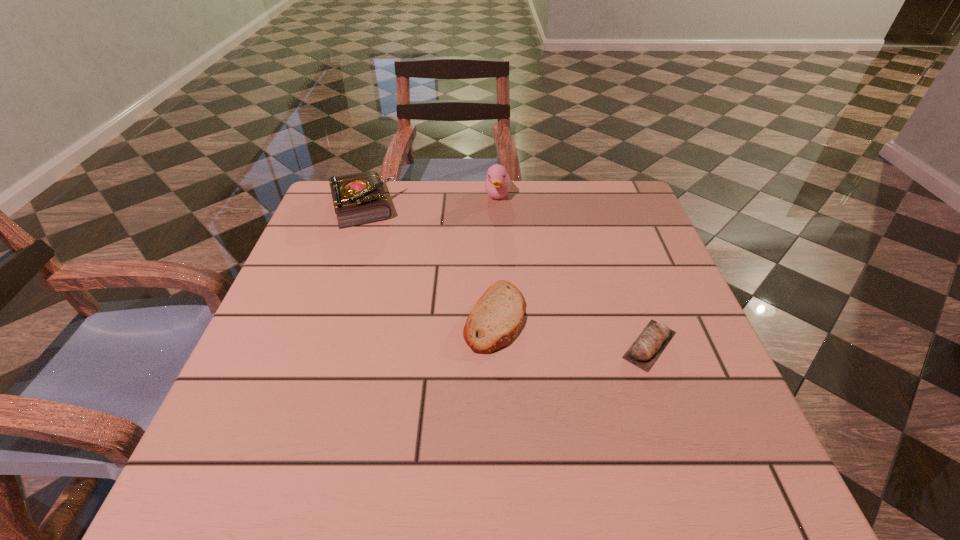
You are a GUI agent. You are given a task and a screenshot of the screen. Output one action in this format:
    pyautogui.click(x=<x>, y=<y>)
    Task: Click on the diary that is at the far edge
    This screenshot has width=960, height=540.
    Given the screenshot: What is the action you would take?
    pyautogui.click(x=359, y=198)

The image size is (960, 540). In order to click on object located in the left edge section of the desktop in this screenshot , I will do `click(359, 198)`.

You are a GUI agent. You are given a task and a screenshot of the screen. Output one action in this format:
    pyautogui.click(x=<x>, y=<y>)
    Task: Click on the object at the right edge
    
    Given the screenshot: What is the action you would take?
    pyautogui.click(x=648, y=346)

Locate an element on the screen. object situated at the far left corner is located at coordinates 359,198.

In the image, there is a desktop. Identify the location of free space at the far edge. (390, 222).

The height and width of the screenshot is (540, 960). In the image, there is a desktop. Identify the location of free space at the left edge. (305, 373).

In the image, there is a desktop. Where is `vacant space at the right edge`? This screenshot has width=960, height=540. vacant space at the right edge is located at coordinates (676, 380).

I want to click on free point at the far left corner, so click(333, 213).

Where is `vacant space at the far right corner`? vacant space at the far right corner is located at coordinates (618, 225).

Find the location of a particular element. The image size is (960, 540). vacant space at the near right corner of the desktop is located at coordinates (690, 487).